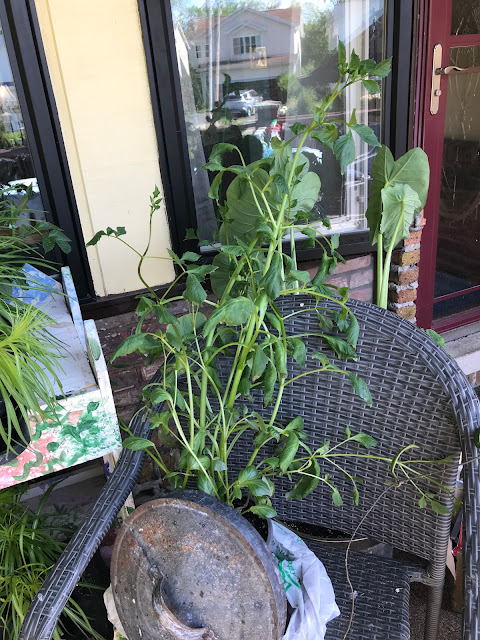
Find the location of a particular element. This screenshot has height=640, width=480. window is located at coordinates (20, 122), (270, 41).